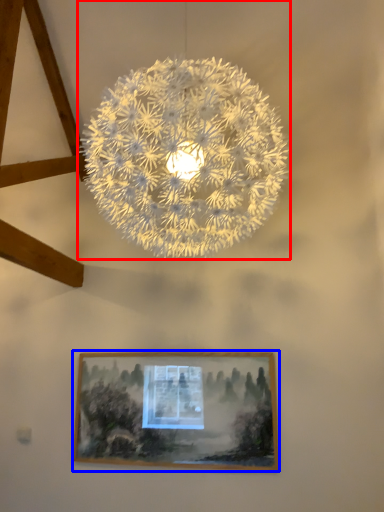
Question: Which object appears farthest to the camera in this image, lamp (highlighted by a red box) or picture frame (highlighted by a blue box)?

Choices:
 (A) lamp
 (B) picture frame

Answer: (B)